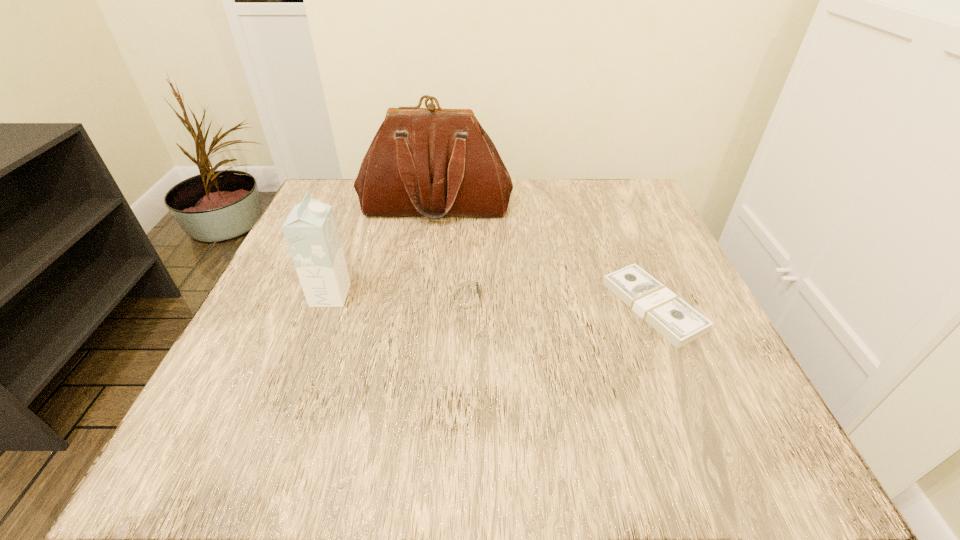
This screenshot has height=540, width=960. I want to click on object situated at the far edge, so click(x=432, y=162).

Where is `shoulder bag that is at the left edge`? shoulder bag that is at the left edge is located at coordinates (432, 162).

Locate an element on the screen. This screenshot has height=540, width=960. carton that is at the left edge is located at coordinates (310, 230).

You are a GUI agent. You are given a task and a screenshot of the screen. Output one action in this format:
    pyautogui.click(x=<x>, y=<y>)
    Task: Click on the object present at the right edge
    
    Given the screenshot: What is the action you would take?
    coord(678,322)

This screenshot has height=540, width=960. I want to click on object located at the far left corner, so click(x=432, y=162).

Locate an element on the screen. Image resolution: width=960 pixels, height=540 pixels. blank area at the far edge is located at coordinates (521, 184).

Identify the location of vacant region at the left edge. (219, 397).

You are a GUI agent. You are given a task and a screenshot of the screen. Output one action in this format:
    pyautogui.click(x=<x>, y=<y>)
    Task: Click on the vacant space at the right edge of the desktop
    Image resolution: width=960 pixels, height=540 pixels.
    Given the screenshot: What is the action you would take?
    pyautogui.click(x=692, y=407)

This screenshot has width=960, height=540. What are the coordinates of `vacant space at the far left corner` in the screenshot? It's located at (331, 200).

Locate an element on the screen. vacant region at the near left corner of the desktop is located at coordinates (260, 450).